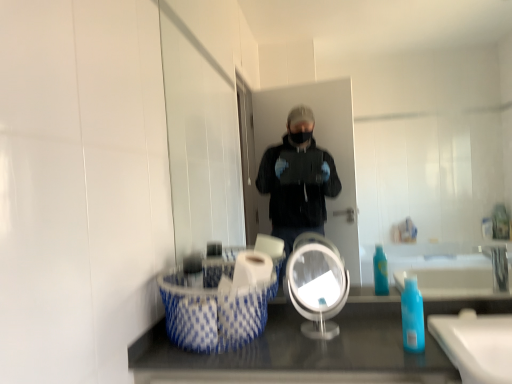
Question: In terms of height, does clear glass mirror at center, the second mirror viewed from the front, look taller or shorter compared to clear plastic mirror at center, the first mirror positioned from the front?

Choices:
 (A) tall
 (B) short

Answer: (A)

Question: Looking at their shapes, would you say clear glass mirror at center, the second mirror viewed from the front, is wider or thinner than clear plastic mirror at center, positioned as the 2th mirror in back-to-front order?

Choices:
 (A) wide
 (B) thin

Answer: (B)

Question: Which is nearer to the blue translucent bottle at lower right?

Choices:
 (A) clear glass mirror at center, which is the 1th mirror from back to front
 (B) clear plastic mirror at center, the first mirror positioned from the front
 (C) blue and white woven laundry basket at lower left
 (D) white glossy toilet paper at center

Answer: (B)

Question: Considering the real-world distances, which object is closest to the blue and white woven laundry basket at lower left?

Choices:
 (A) clear plastic mirror at center, the first mirror positioned from the front
 (B) clear glass mirror at center, the second mirror viewed from the front
 (C) white glossy toilet paper at center
 (D) blue translucent bottle at lower right

Answer: (C)